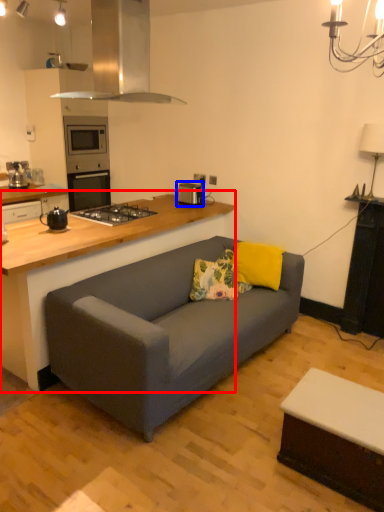
Question: Which object appears closest to the camera in this image, countertop (highlighted by a red box) or appliance (highlighted by a blue box)?

Choices:
 (A) countertop
 (B) appliance

Answer: (A)